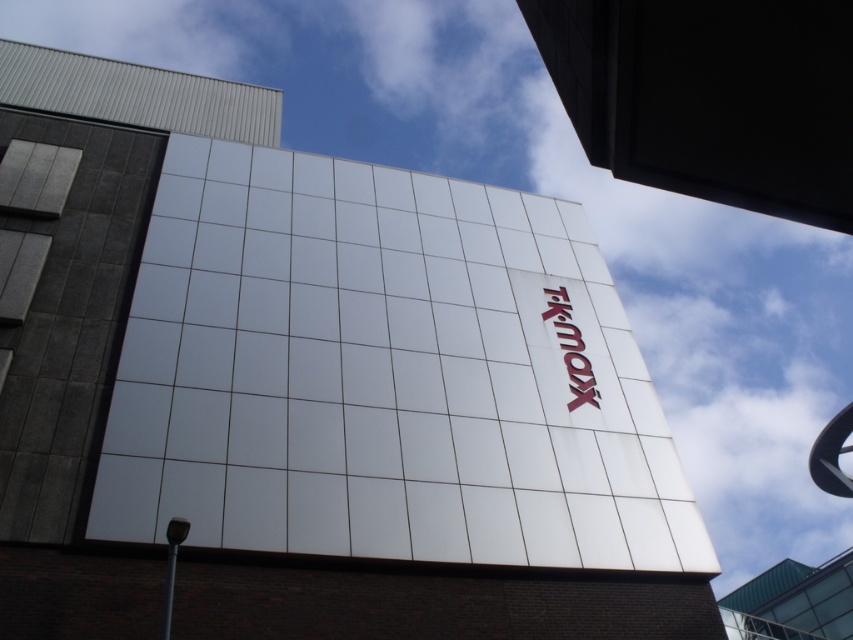
You are a delivery driver approaching the building and need to read both the white glossy sign at upper center and the red glossy sign at upper center. Which sign should you look up to first?

The white glossy sign at upper center is above the red glossy sign at upper center, so you should look up to the white glossy sign at upper center first.

You are standing in front of the modern building and notice a point at coordinates (711, 97). Which object does this point belong to?

The point at coordinates (711, 97) is on the white glossy sign at upper center.